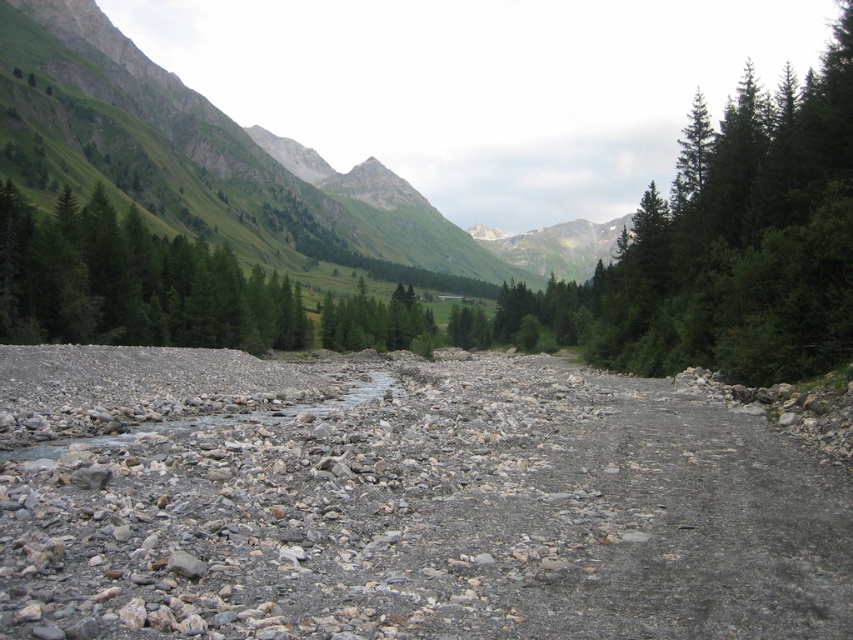
Which is above, green matte tree at left or green matte tree at center?

green matte tree at left

Who is lower down, green matte tree at left or green matte tree at center?

green matte tree at center is below.

Does point (3, 220) lie in front of point (398, 337)?

Yes, point (3, 220) is closer to viewer.

Identify the location of green matte tree at left. (132, 284).

Between gray gravel bed at center and green matte tree at center, which one appears on the right side from the viewer's perspective?

From the viewer's perspective, gray gravel bed at center appears more on the right side.

Is gray gravel bed at center bigger than green matte tree at center?

No.

Which is behind, point (698, 433) or point (409, 346)?

The point (409, 346) is more distant.

You are a GUI agent. You are given a task and a screenshot of the screen. Output one action in this format:
    pyautogui.click(x=<x>, y=<y>)
    Task: Click on the gray gravel bed at center
    Image resolution: width=853 pixels, height=640 pixels.
    Given the screenshot: What is the action you would take?
    pos(442,518)

Can you confirm if gray gravel bed at center is positioned to the right of green matte tree at left?

Correct, you'll find gray gravel bed at center to the right of green matte tree at left.

What do you see at coordinates (442, 518) in the screenshot? The height and width of the screenshot is (640, 853). I see `gray gravel bed at center` at bounding box center [442, 518].

Locate an element on the screen. This screenshot has width=853, height=640. gray gravel bed at center is located at coordinates (442, 518).